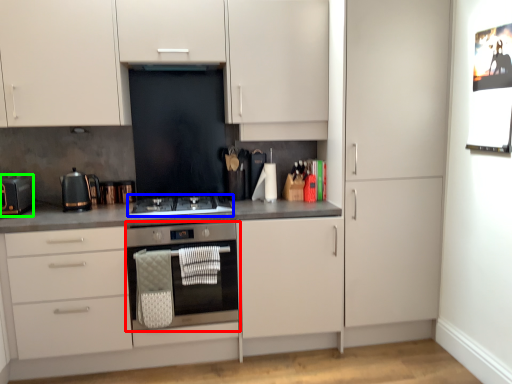
Question: Based on their relative distances, which object is farther from home appliance (highlighted by a red box)? Choose from gas stove (highlighted by a blue box) and kitchen appliance (highlighted by a green box).

Choices:
 (A) gas stove
 (B) kitchen appliance

Answer: (B)